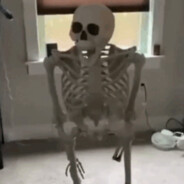
The image size is (184, 184). I want to click on power cord, so click(146, 95).